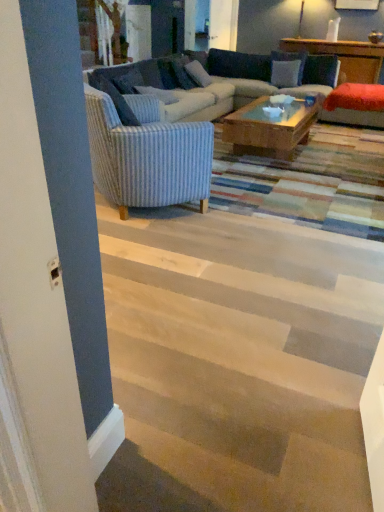
Question: Visually, is blue striped pillow at upper left, placed as the first pillow when sorted from left to right, positioned to the left or to the right of blue striped pillow at center, the 2th pillow in the left-to-right sequence?

Choices:
 (A) left
 (B) right

Answer: (A)

Question: Is blue striped pillow at upper left, marked as the fourth pillow in a right-to-left arrangement, in front of or behind blue striped pillow at center, the 2th pillow in the left-to-right sequence, in the image?

Choices:
 (A) behind
 (B) front

Answer: (B)

Question: Estimate the real-world distances between objects in this image. Which object is farther from the wooden stairs at lower center?

Choices:
 (A) striped fabric couch at center
 (B) blue striped pillow at upper left, placed as the first pillow when sorted from left to right
 (C) suede-like blue pillow at upper center, the first pillow in the right-to-left sequence
 (D) blue striped pillow at center, which is the third pillow from right to left
 (E) white fabric pillow at upper center, marked as the third pillow in a left-to-right arrangement

Answer: (C)

Question: Estimate the real-world distances between objects in this image. Which object is closer to the blue striped pillow at center, which is the third pillow from right to left?

Choices:
 (A) white fabric pillow at upper center, the 2th pillow viewed from the right
 (B) striped fabric couch at center
 (C) blue striped pillow at upper left, marked as the fourth pillow in a right-to-left arrangement
 (D) suede-like blue pillow at upper center, marked as the fourth pillow in a left-to-right arrangement
 (E) wooden stairs at lower center

Answer: (B)